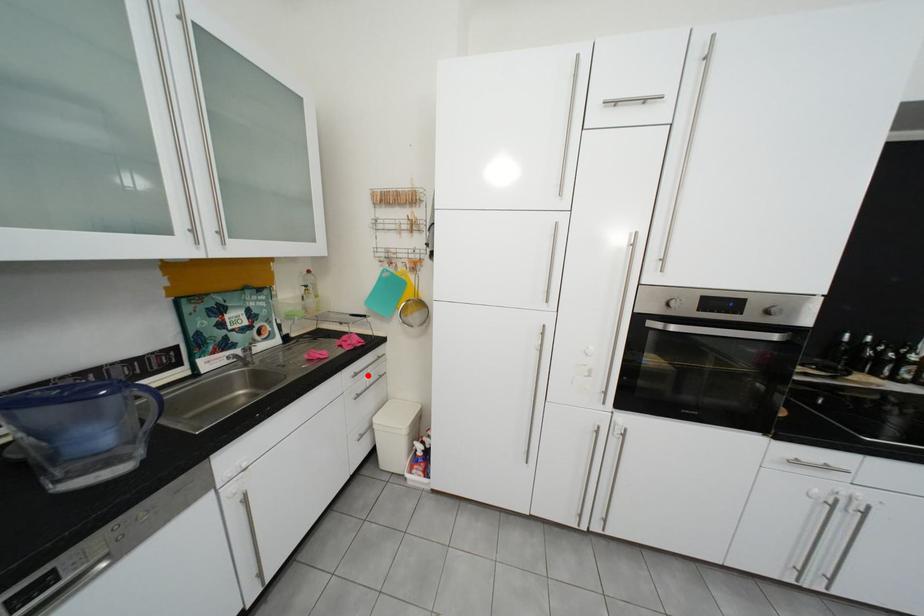
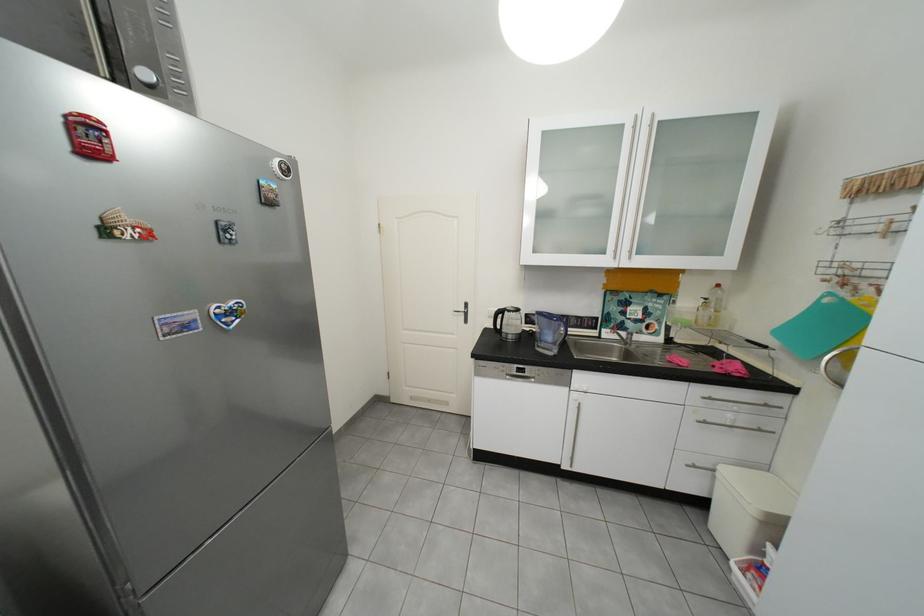
Where in the second image is the point corresponding to the highlighted location from the first image?

(723, 400)